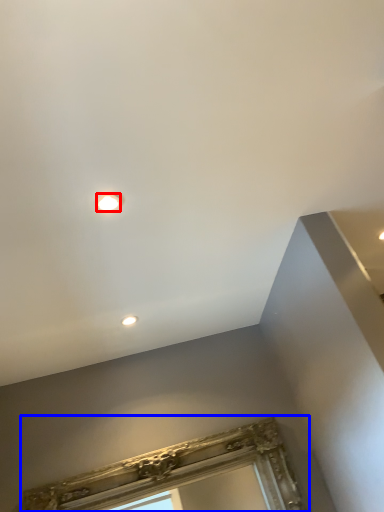
Question: Which of the following is the farthest to the observer, droplight (highlighted by a red box) or window frame (highlighted by a blue box)?

Choices:
 (A) droplight
 (B) window frame

Answer: (B)